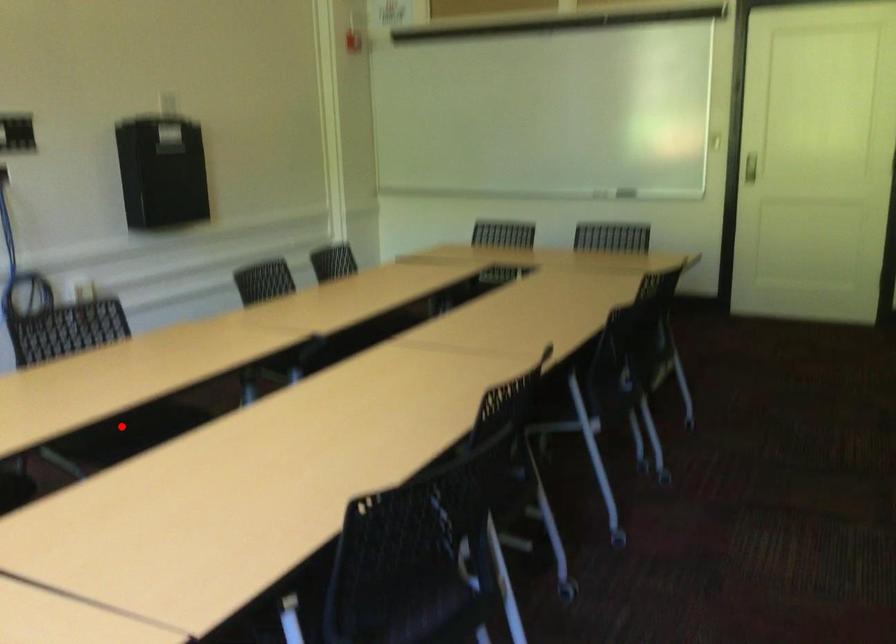
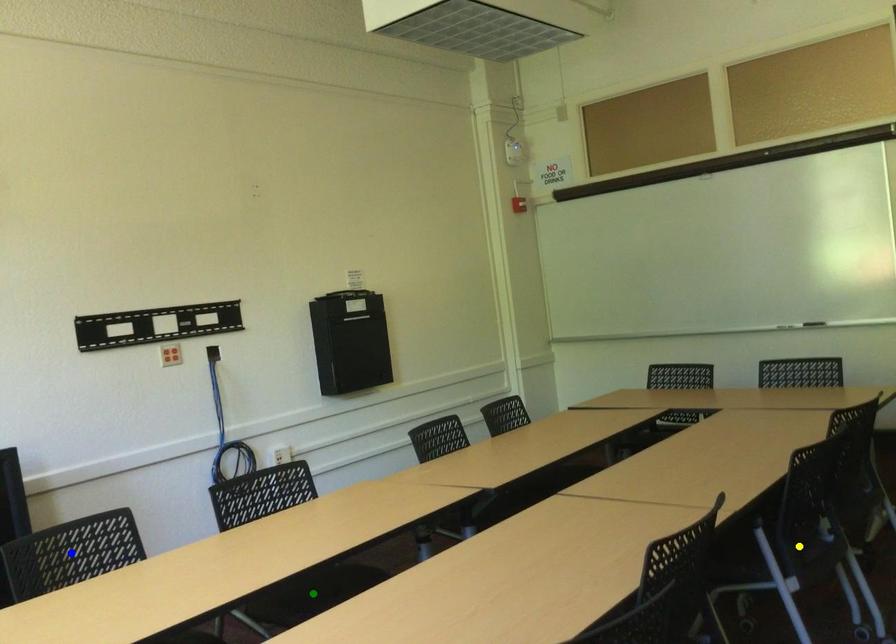
Question: I am providing you with two images of the same scene from different viewpoints. A red point is marked on the first image. You are given multiple points on the second image. Which spot in image 2 lines up with the point in image 1?

Choices:
 (A) yellow point
 (B) green point
 (C) blue point

Answer: (B)